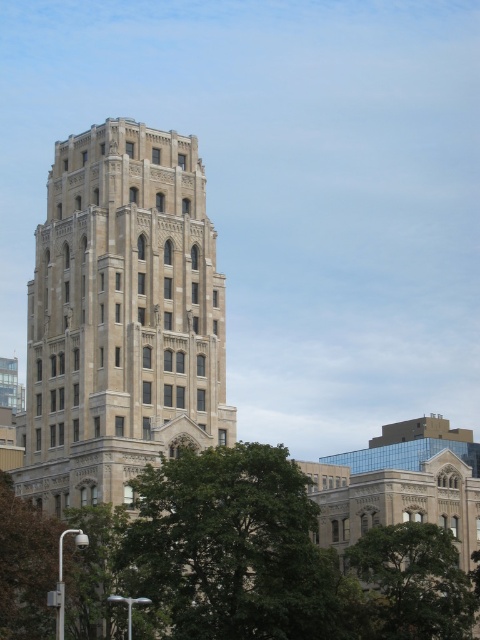
Does green leafy tree at center have a larger size compared to green leafy tree at lower left?

Yes, green leafy tree at center is bigger than green leafy tree at lower left.

Is point (228, 604) less distant than point (20, 504)?

Yes, it is.

Which is behind, point (190, 493) or point (14, 541)?

Point (14, 541)

This screenshot has width=480, height=640. Identify the location of green leafy tree at center. (231, 547).

Which of these two, green leafy tree at center or green leafy tree at lower right, stands shorter?

Standing shorter between the two is green leafy tree at lower right.

Who is lower down, green leafy tree at center or green leafy tree at lower right?

Positioned lower is green leafy tree at lower right.

Find the location of `green leafy tree at center`. green leafy tree at center is located at coordinates (231, 547).

Does green leafy tree at lower right appear over green leafy tree at lower left?

No, green leafy tree at lower right is not above green leafy tree at lower left.

What are the coordinates of `green leafy tree at lower right` in the screenshot? It's located at coord(414,582).